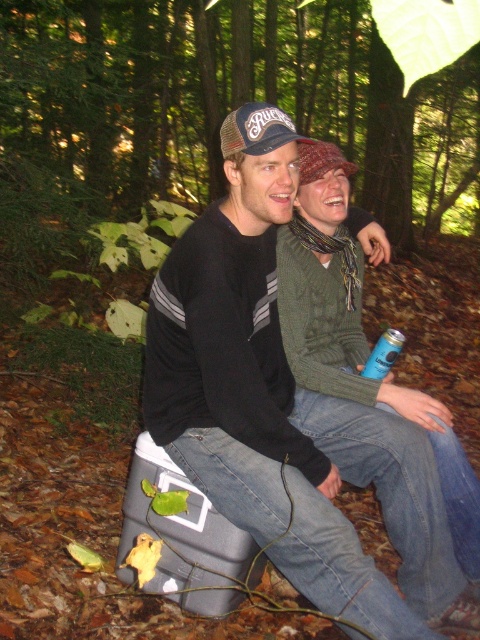
You are organizing a picnic and need to place the green knitted sweater at center and the blue matte can at lower center on a small table. Which item should you place first to ensure they fit properly?

The green knitted sweater at center should be placed first since it is positioned to the left of the blue matte can at lower center, so placing it first ensures proper alignment.

You are organizing a picnic and need to place the black knit sweater at center and the blue matte can at lower center. Based on their positions, which item is closer to the cooler where the person is sitting?

The black knit sweater at center is closer to the cooler where the person is sitting because it is positioned to the left of the blue matte can at lower center, which is further away from the cooler.